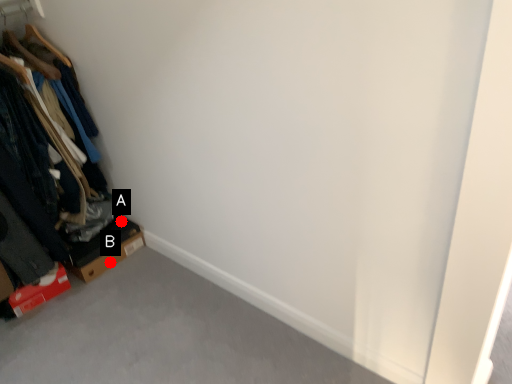
Question: Two points are circled on the image, labeled by A and B beside each circle. Which point appears farthest from the camera in this image?

Choices:
 (A) A is further
 (B) B is further

Answer: (A)